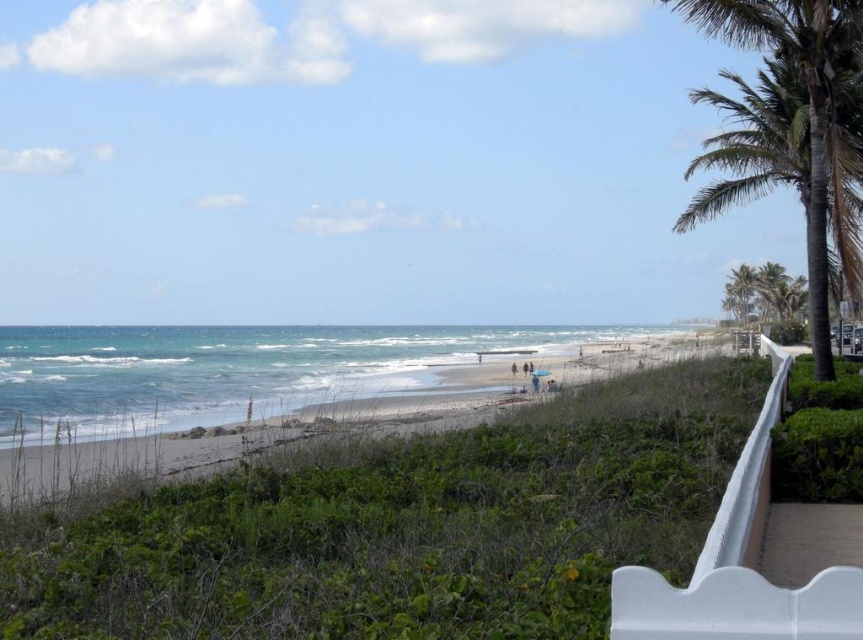
Question: Observing the image, what is the correct spatial positioning of white plastic balustrade at right in reference to green leafy palm tree at right?

Choices:
 (A) right
 (B) left

Answer: (B)

Question: Does sandy beach at center appear under green leafy palm tree at right?

Choices:
 (A) yes
 (B) no

Answer: (A)

Question: Which point is closer to the camera taking this photo?

Choices:
 (A) coord(404,406)
 (B) coord(808,636)

Answer: (B)

Question: Is white plastic balustrade at right behind green leafy palm tree at right?

Choices:
 (A) yes
 (B) no

Answer: (B)

Question: Which is nearer to the green leafy palm tree at right?

Choices:
 (A) sandy beach at center
 (B) white plastic balustrade at right

Answer: (B)

Question: Which is nearer to the green leafy palm tree at right?

Choices:
 (A) white plastic balustrade at right
 (B) sandy beach at center

Answer: (A)